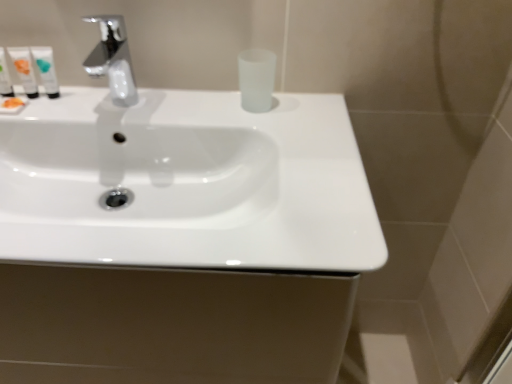
Identify the location of vacant region in front of white glossy tube at upper left, the 2th mouthwash positioned from the right. The width and height of the screenshot is (512, 384). (42, 120).